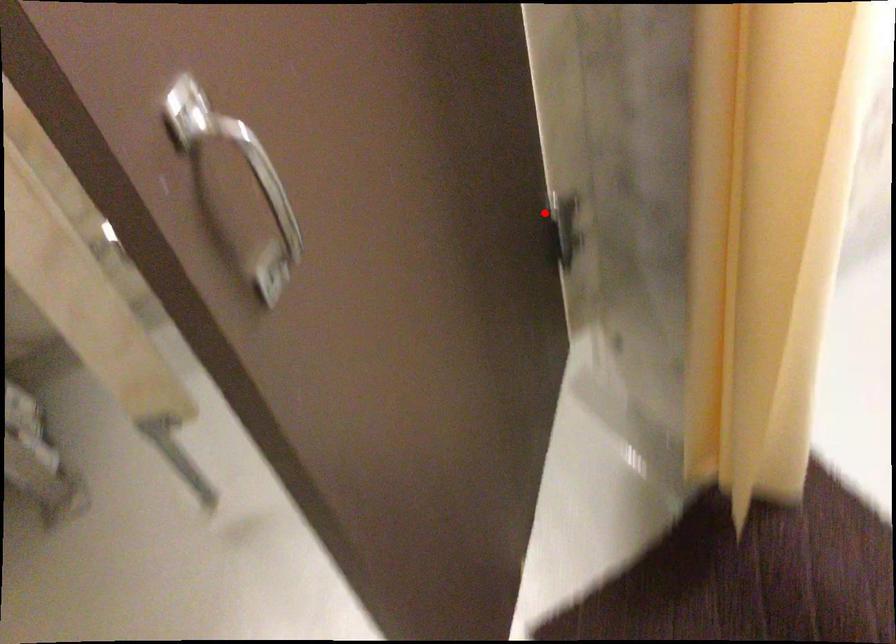
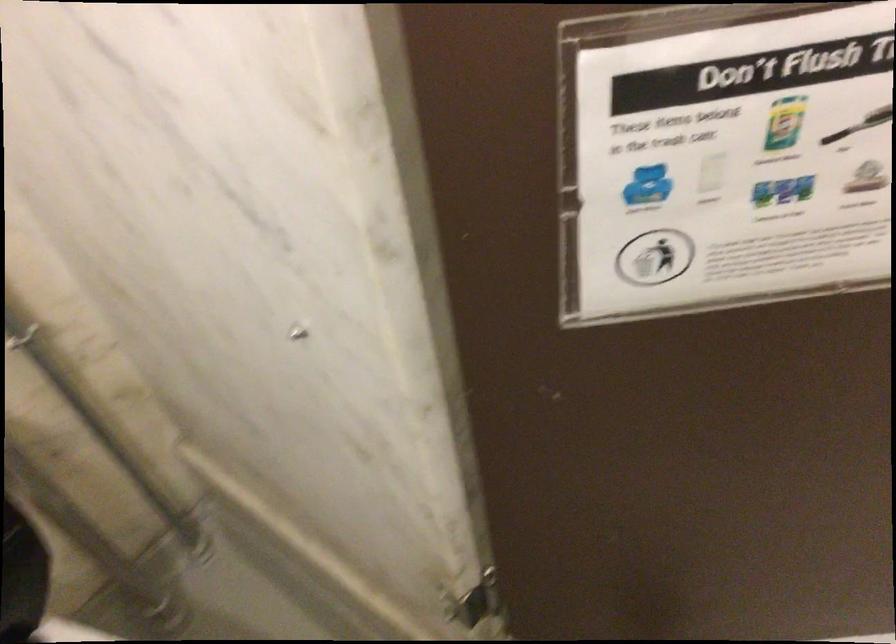
Question: I am providing you with two images of the same scene from different viewpoints. Given a red point in image1, look at the same physical point in image2. Is it:

Choices:
 (A) Closer to the viewpoint
 (B) Farther from the viewpoint

Answer: (A)